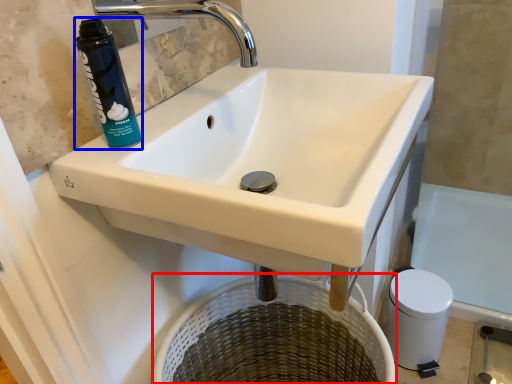
Question: Which of the following is the closest to the observer, basket (highlighted by a red box) or cleaning product (highlighted by a blue box)?

Choices:
 (A) basket
 (B) cleaning product

Answer: (B)